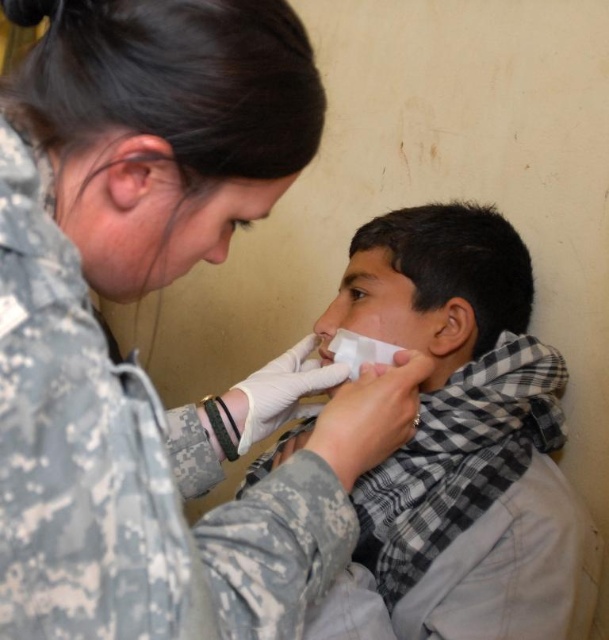
Between camouflage uniform at center and white checkered scarf at center, which one appears on the right side from the viewer's perspective?

Positioned to the right is white checkered scarf at center.

Who is shorter, camouflage uniform at center or white checkered scarf at center?

With less height is camouflage uniform at center.

What do you see at coordinates (139, 296) in the screenshot?
I see `camouflage uniform at center` at bounding box center [139, 296].

This screenshot has width=609, height=640. I want to click on camouflage uniform at center, so click(139, 296).